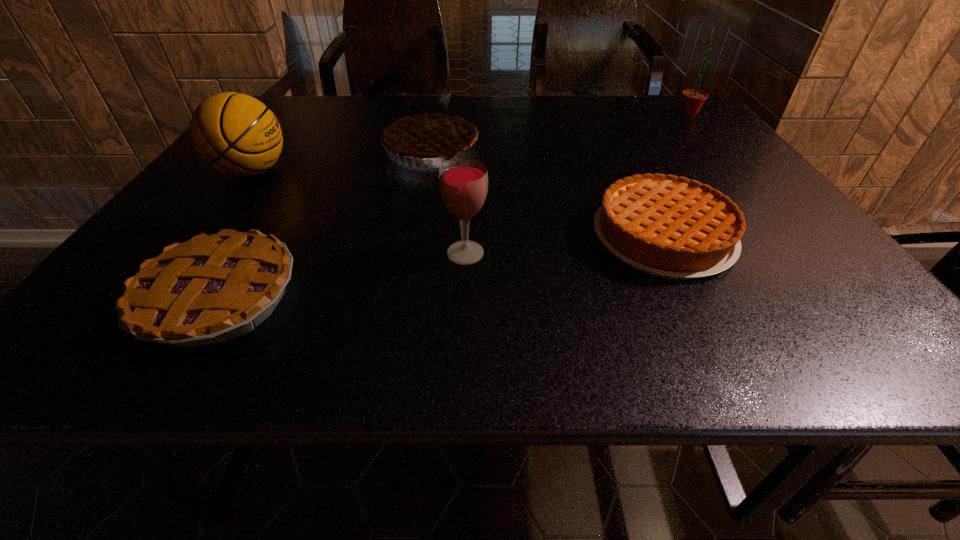
Identify which pie is located as the nearest to the wineglass. Please provide its 2D coordinates. Your answer should be formatted as a tuple, i.e. [(x, y)], where the tuple contains the x and y coordinates of a point satisfying the conditions above.

[(668, 226)]

Image resolution: width=960 pixels, height=540 pixels. I want to click on vacant space that satisfies the following two spatial constraints: 1. on the front side of the tallest pie; 2. on the right side of the fifth object from left to right, so click(x=416, y=235).